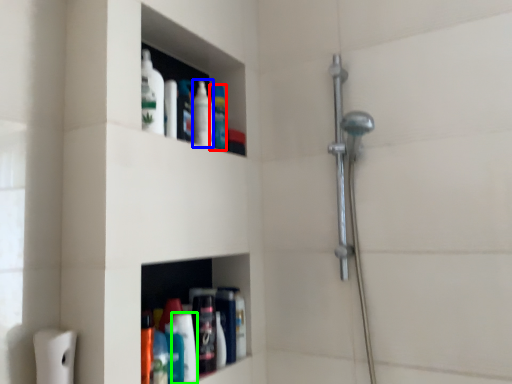
Question: Which is farther away from cleaning product (highlighted by a red box)? mouthwash (highlighted by a blue box) or cleaning product (highlighted by a green box)?

Choices:
 (A) mouthwash
 (B) cleaning product

Answer: (B)